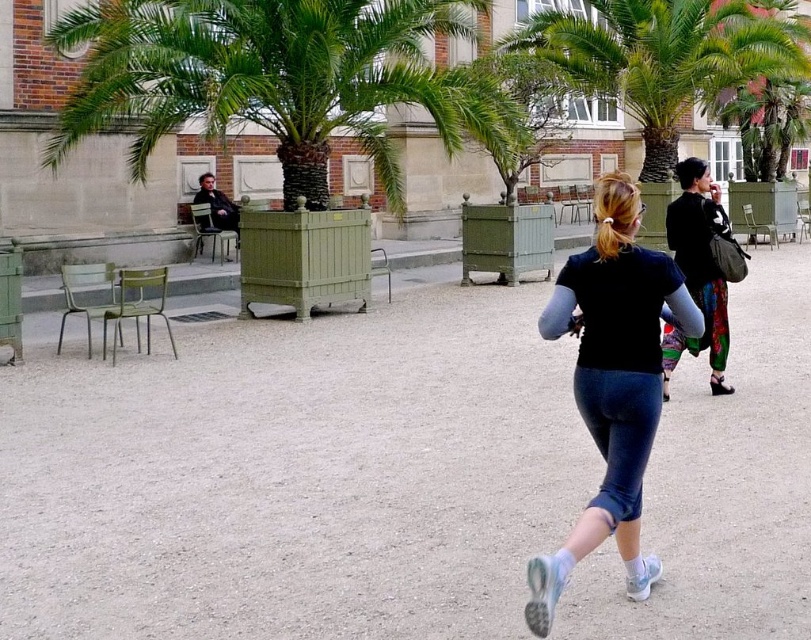
Does dark blue jersey at center have a smaller size compared to matte black jacket at left?

No, dark blue jersey at center is not smaller than matte black jacket at left.

Can you confirm if dark blue jersey at center is taller than matte black jacket at left?

Yes.

Does point (537, 634) come behind point (226, 225)?

That is False.

You are a GUI agent. You are given a task and a screenshot of the screen. Output one action in this format:
    pyautogui.click(x=<x>, y=<y>)
    Task: Click on the dark blue jersey at center
    
    Given the screenshot: What is the action you would take?
    pyautogui.click(x=611, y=403)

Who is more forward, [612,468] or [709,232]?

Point [612,468]

Can you confirm if dark blue jersey at center is thinner than black textured sweater at right?

Incorrect, dark blue jersey at center's width is not less than black textured sweater at right's.

Does point (607, 451) lie behind point (689, 289)?

No, it is not.

In order to click on dark blue jersey at center in this screenshot , I will do `click(611, 403)`.

Is point (687, 180) behind point (599, 248)?

Yes.

Is black textured sweater at right to the left of blonde hair at center from the viewer's perspective?

Correct, you'll find black textured sweater at right to the left of blonde hair at center.

Is point (698, 243) more distant than point (611, 250)?

Yes, point (698, 243) is farther from viewer.

Where is `black textured sweater at right`? The image size is (811, 640). black textured sweater at right is located at coordinates (698, 269).